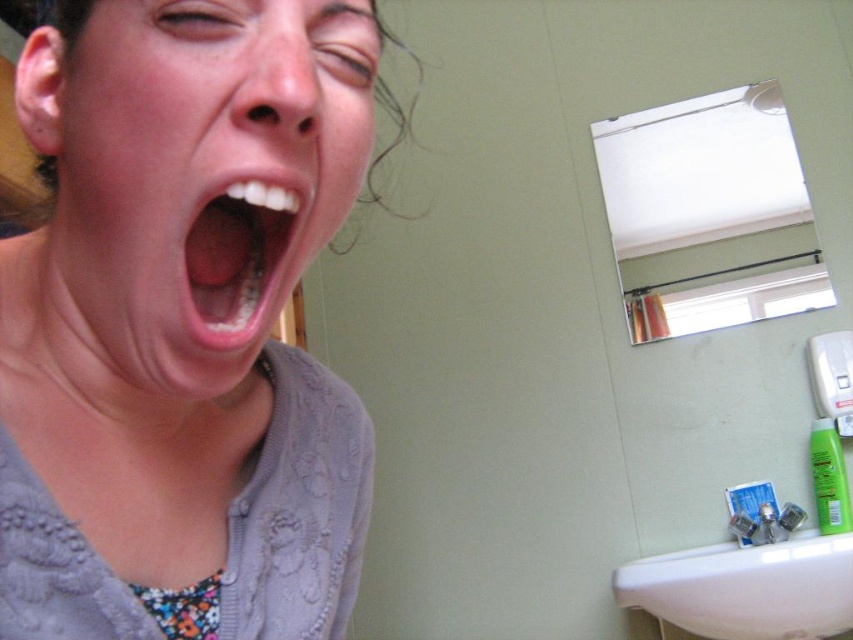
You are a bathroom assistant trying to clean the sink. You see the white ceramic sink at lower right and the pink glossy lips at center. Which object is located below the other?

The white ceramic sink at lower right is positioned under the pink glossy lips at center.

You are a bathroom designer planning to place a new toothbrush holder between the white ceramic sink at lower right and the pink glossy lips at center. Based on their widths, can the toothbrush holder fit between them without overlapping?

The white ceramic sink at lower right might be wider than pink glossy lips at center, so there might be enough space for the toothbrush holder between them without overlapping.